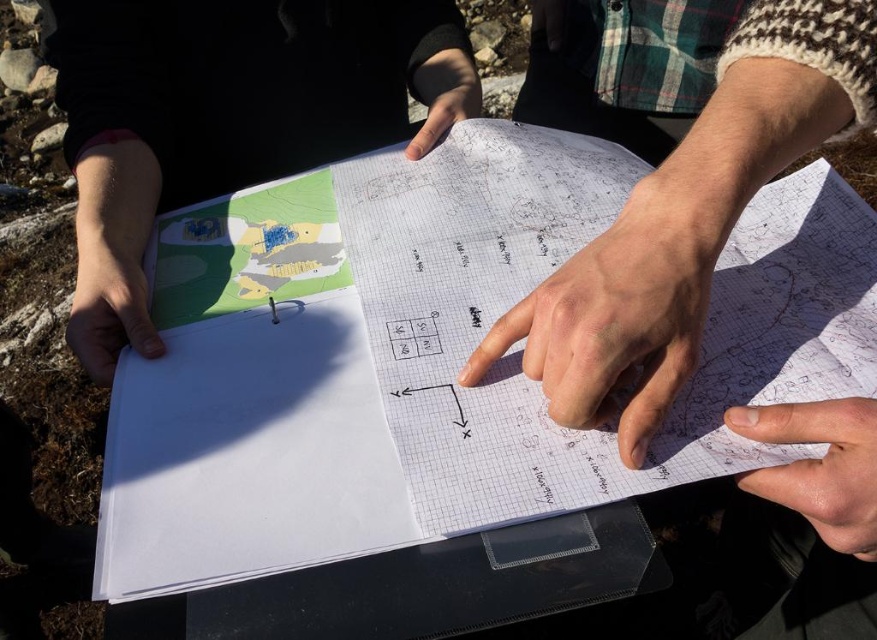
Looking at this image, can you confirm if smooth paper hand at center is wider than smooth skin hand at lower right?

Yes, smooth paper hand at center is wider than smooth skin hand at lower right.

Which is behind, point (633, 248) or point (742, 412)?

The point (633, 248) is more distant.

Describe the element at coordinates (621, 312) in the screenshot. I see `smooth paper hand at center` at that location.

Where is `smooth paper hand at center`? smooth paper hand at center is located at coordinates (621, 312).

Who is lower down, matte paper map at upper left or smooth paper hand at center?

Positioned lower is smooth paper hand at center.

This screenshot has width=877, height=640. I want to click on matte paper map at upper left, so click(227, 116).

Is matte paper map at upper left below matte white paper at lower left?

Incorrect, matte paper map at upper left is not positioned below matte white paper at lower left.

Is matte paper map at upper left above matte white paper at lower left?

A: Yes.

Locate an element on the screen. Image resolution: width=877 pixels, height=640 pixels. matte paper map at upper left is located at coordinates (227, 116).

Find the location of a particular element. matte paper map at upper left is located at coordinates (227, 116).